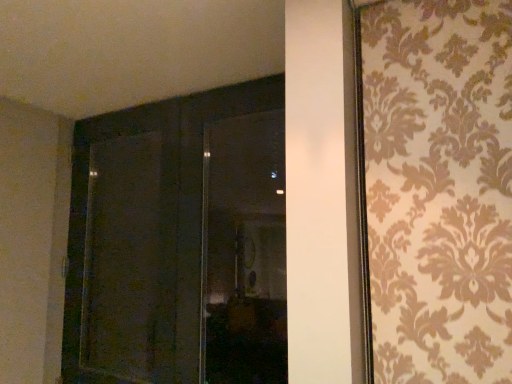
Question: From a real-world perspective, is transparent glass window at center beneath dark wood door at center?

Choices:
 (A) yes
 (B) no

Answer: (B)

Question: Does transparent glass window at center contain dark wood door at center?

Choices:
 (A) no
 (B) yes

Answer: (A)

Question: Does transparent glass window at center have a larger size compared to dark wood door at center?

Choices:
 (A) no
 (B) yes

Answer: (A)

Question: Is transparent glass window at center with dark wood door at center?

Choices:
 (A) yes
 (B) no

Answer: (B)

Question: Is transparent glass window at center oriented away from dark wood door at center?

Choices:
 (A) no
 (B) yes

Answer: (B)

Question: Is transparent glass window at center shorter than dark wood door at center?

Choices:
 (A) yes
 (B) no

Answer: (A)

Question: From a real-world perspective, is matte dark wood screen door at left positioned under transparent glass window at center based on gravity?

Choices:
 (A) no
 (B) yes

Answer: (B)

Question: From the image's perspective, would you say matte dark wood screen door at left is positioned over transparent glass window at center?

Choices:
 (A) yes
 (B) no

Answer: (B)

Question: Does matte dark wood screen door at left have a larger size compared to transparent glass window at center?

Choices:
 (A) no
 (B) yes

Answer: (B)

Question: Can you confirm if matte dark wood screen door at left is wider than transparent glass window at center?

Choices:
 (A) yes
 (B) no

Answer: (A)

Question: Does matte dark wood screen door at left turn towards transparent glass window at center?

Choices:
 (A) no
 (B) yes

Answer: (A)

Question: Does matte dark wood screen door at left appear on the right side of transparent glass window at center?

Choices:
 (A) yes
 (B) no

Answer: (B)

Question: Is dark wood door at center far from transparent glass window at center?

Choices:
 (A) yes
 (B) no

Answer: (B)